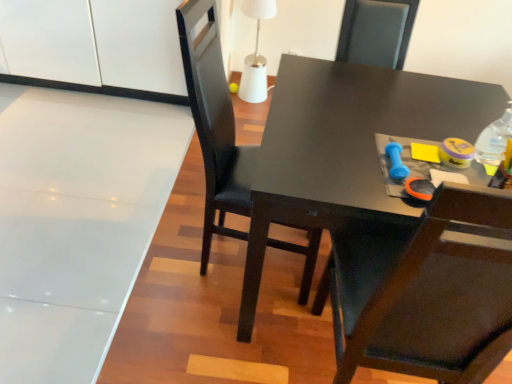
Image resolution: width=512 pixels, height=384 pixels. Find the location of `vacant space behind blue rubber dumbbell at upper right`. vacant space behind blue rubber dumbbell at upper right is located at coordinates (378, 130).